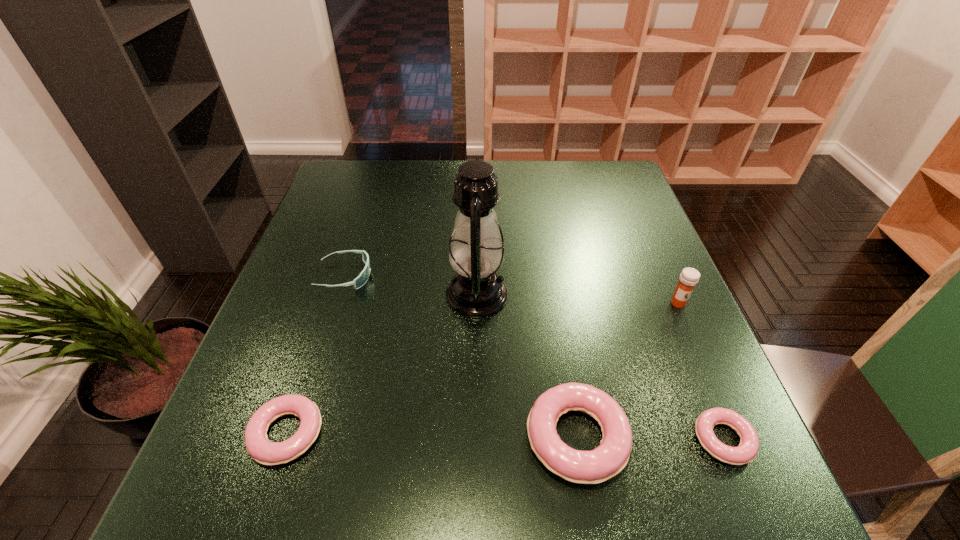
What are the coordinates of `unoccupied position between the second tallest object and the tallest object` in the screenshot? It's located at (578, 299).

The image size is (960, 540). I want to click on free space between the goggles and the shortest object, so click(534, 358).

The height and width of the screenshot is (540, 960). I want to click on free space between the tallest doughnut and the goggles, so click(x=461, y=357).

You are a GUI agent. You are given a task and a screenshot of the screen. Output one action in this format:
    pyautogui.click(x=<x>, y=<y>)
    Task: Click on the vacant space in between the leftmost doughnut and the goggles
    
    Given the screenshot: What is the action you would take?
    pyautogui.click(x=316, y=355)

This screenshot has width=960, height=540. In order to click on vacant space that's between the second shortest doughnut and the second doughnut from left to right in this screenshot , I will do [x=432, y=436].

This screenshot has width=960, height=540. I want to click on vacant point located between the rightmost doughnut and the tallest object, so click(x=600, y=367).

This screenshot has width=960, height=540. I want to click on free spot between the fourth object from right to left and the tallest doughnut, so click(527, 366).

Locate an element on the screen. Image resolution: width=960 pixels, height=540 pixels. vacant area between the medicine and the fourth object from left to right is located at coordinates (628, 370).

Point out which object is positioned as the fifth nearest to the shortest object. Please provide its 2D coordinates. Your answer should be formatted as a tuple, i.e. [(x, y)], where the tuple contains the x and y coordinates of a point satisfying the conditions above.

[(358, 282)]

Select which object is the closest to the tallest object. Please provide its 2D coordinates. Your answer should be formatted as a tuple, i.e. [(x, y)], where the tuple contains the x and y coordinates of a point satisfying the conditions above.

[(608, 459)]